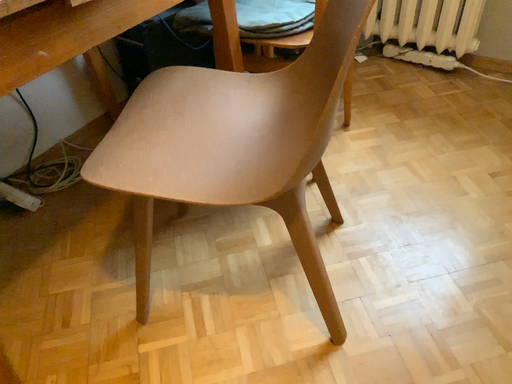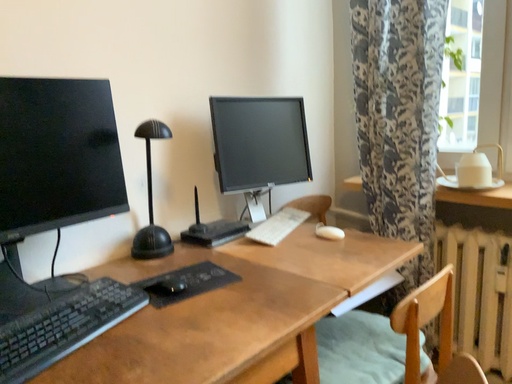
Question: How did the camera likely rotate when shooting the video?

Choices:
 (A) rotated downward
 (B) rotated upward

Answer: (B)